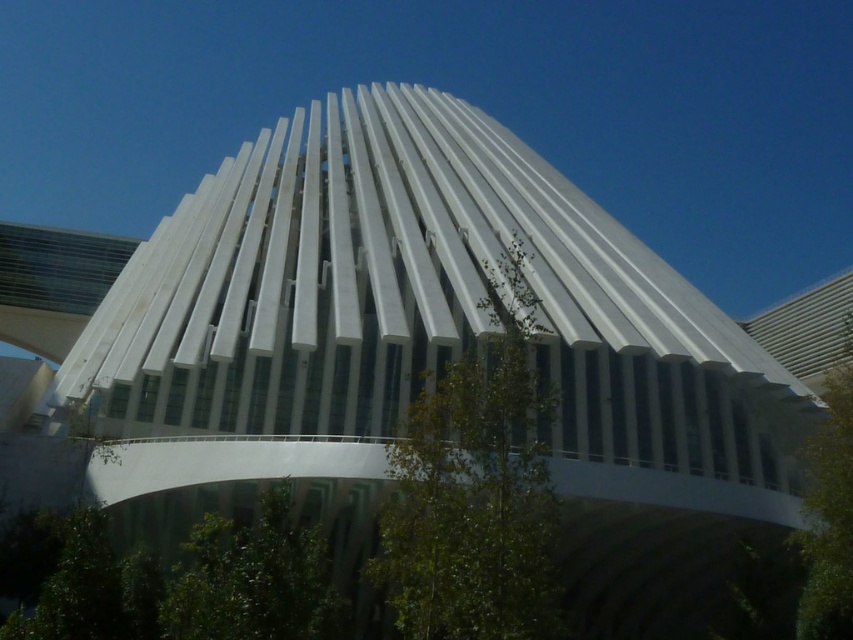
Does green leafy tree at lower left have a larger size compared to green leafy tree at right?

No.

Is green leafy tree at lower left thinner than green leafy tree at right?

Indeed, green leafy tree at lower left has a lesser width compared to green leafy tree at right.

Which is behind, point (259, 628) or point (824, 435)?

The point (824, 435) is behind.

Where is `green leafy tree at lower left`? green leafy tree at lower left is located at coordinates (252, 579).

In the scene shown: Does green leafy tree at center appear over green leafy tree at lower left?

Yes.

Describe the element at coordinates (474, 484) in the screenshot. I see `green leafy tree at center` at that location.

Measure the distance between point (529, 371) and camera.

31.44 meters

This screenshot has width=853, height=640. I want to click on green leafy tree at center, so click(474, 484).

Can you confirm if green leafy tree at center is positioned below green leafy tree at right?

Correct, green leafy tree at center is located below green leafy tree at right.

Measure the distance from green leafy tree at center to green leafy tree at right.

green leafy tree at center and green leafy tree at right are 78.06 feet apart.

You are a GUI agent. You are given a task and a screenshot of the screen. Output one action in this format:
    pyautogui.click(x=<x>, y=<y>)
    Task: Click on the green leafy tree at center
    Image resolution: width=853 pixels, height=640 pixels.
    Given the screenshot: What is the action you would take?
    click(x=474, y=484)

Where is `green leafy tree at center`? green leafy tree at center is located at coordinates (474, 484).